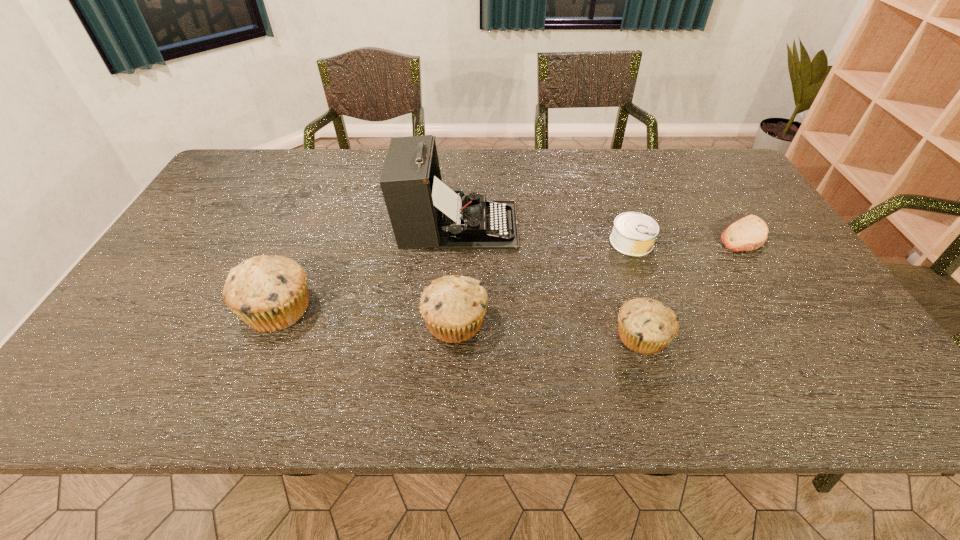
The width and height of the screenshot is (960, 540). Identify the location of free space located 0.340m on the right of the second shortest muffin. pos(636,322).

Identify the location of vacant area situated 0.120m on the back of the shortest muffin. This screenshot has height=540, width=960. (623, 278).

I want to click on vacant space situated 0.180m on the right of the second shortest object, so click(x=719, y=242).

Identify the location of vacant space located on the back of the rightmost object. The height and width of the screenshot is (540, 960). (713, 188).

Image resolution: width=960 pixels, height=540 pixels. I want to click on vacant area located inside the open case of the typewriter, so click(631, 225).

Where is `object present at the right edge`? object present at the right edge is located at coordinates (749, 233).

This screenshot has width=960, height=540. I want to click on vacant space at the far edge of the desktop, so click(x=625, y=187).

Where is `free space at the near edge`? This screenshot has width=960, height=540. free space at the near edge is located at coordinates (360, 333).

I want to click on vacant area at the left edge, so click(178, 310).

The height and width of the screenshot is (540, 960). I want to click on vacant area at the right edge, so click(x=731, y=210).